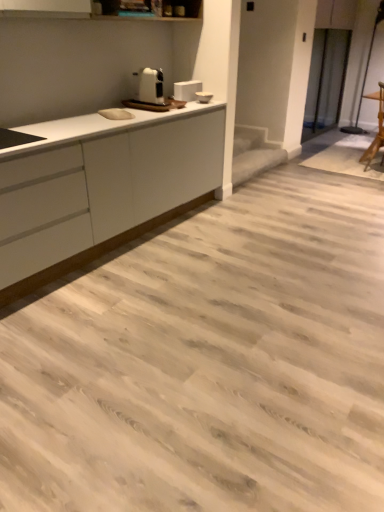
What do you see at coordinates (187, 90) in the screenshot?
I see `white glossy toaster at upper center` at bounding box center [187, 90].

Where is `white plastic toaster at upper center`? The width and height of the screenshot is (384, 512). white plastic toaster at upper center is located at coordinates (150, 86).

What do you see at coordinates (150, 86) in the screenshot?
I see `white plastic toaster at upper center` at bounding box center [150, 86].

Locate an element on the screen. Image resolution: width=384 pixels, height=512 pixels. wooden chair at right is located at coordinates (377, 132).

Image resolution: width=384 pixels, height=512 pixels. I want to click on white glossy toaster at upper center, so click(187, 90).

From the image's perspective, which is above, white plastic toaster at upper center or wooden chair at right?

wooden chair at right.

Does white plastic toaster at upper center contain wooden chair at right?

That's incorrect, wooden chair at right is not inside white plastic toaster at upper center.

Is white plastic toaster at upper center facing away from wooden chair at right?

No, wooden chair at right is not at the back of white plastic toaster at upper center.

How different are the orientations of white plastic toaster at upper center and wooden chair at right in degrees?

white plastic toaster at upper center and wooden chair at right are facing 77.8 degrees away from each other.

Is white matte countertop at left a part of white plastic toaster at upper center?

No, white matte countertop at left is not a part of white plastic toaster at upper center.

Does white plastic toaster at upper center turn towards white matte countertop at left?

No, white plastic toaster at upper center is not turned towards white matte countertop at left.

From a real-world perspective, is white plastic toaster at upper center above or below white matte countertop at left?

white plastic toaster at upper center is above white matte countertop at left.

The height and width of the screenshot is (512, 384). I want to click on home appliance that is above the white matte countertop at left (from the image's perspective), so click(x=150, y=86).

Is white matte countertop at left beside white glossy toaster at upper center?

No, white matte countertop at left is not with white glossy toaster at upper center.

Is white matte countertop at left inside the boundaries of white glossy toaster at upper center, or outside?

white matte countertop at left is outside white glossy toaster at upper center.

Is white matte countertop at left shorter than white glossy toaster at upper center?

Incorrect, the height of white matte countertop at left does not fall short of that of white glossy toaster at upper center.

From the image's perspective, which one is positioned higher, white matte countertop at left or white glossy toaster at upper center?

From the image's view, white glossy toaster at upper center is above.

Is point (140, 75) closer to viewer compared to point (178, 96)?

Yes, it is in front of point (178, 96).

Who is shorter, white plastic toaster at upper center or white glossy toaster at upper center?

With less height is white glossy toaster at upper center.

From a real-world perspective, is white plastic toaster at upper center above or below white glossy toaster at upper center?

Clearly, from a real-world perspective, white plastic toaster at upper center is above white glossy toaster at upper center.

Does point (373, 141) lie in front of point (179, 84)?

No, (373, 141) is behind (179, 84).

Looking at this image, between wooden chair at right and white glossy toaster at upper center, which one is positioned in front?

Positioned in front is white glossy toaster at upper center.

Is white glossy toaster at upper center at the back of wooden chair at right?

wooden chair at right does not have its back to white glossy toaster at upper center.

What's the angular difference between wooden chair at right and white glossy toaster at upper center's facing directions?

77.8 degrees.

From the image's perspective, which one is positioned lower, white matte countertop at left or wooden chair at right?

white matte countertop at left is shown below in the image.

Is point (91, 175) farther from viewer compared to point (382, 82)?

No, (91, 175) is closer to viewer.

What's the angular difference between white matte countertop at left and wooden chair at right's facing directions?

77.8 degrees.

At what (x,y) coordinates should I click in order to perform the action: click on chair on the right of white matte countertop at left. Please return your answer as a coordinate pair (x, y). Looking at the image, I should click on (377, 132).

Is white glossy toaster at upper center located outside wooden chair at right?

Absolutely, white glossy toaster at upper center is external to wooden chair at right.

Is white glossy toaster at upper center facing away from wooden chair at right?

No.

Considering the relative sizes of white glossy toaster at upper center and wooden chair at right in the image provided, is white glossy toaster at upper center bigger than wooden chair at right?

No.

Find the location of a particular element. The image size is (384, 512). chair that appears above the white plastic toaster at upper center (from the image's perspective) is located at coordinates (377, 132).

Image resolution: width=384 pixels, height=512 pixels. In order to click on home appliance behind the white matte countertop at left in this screenshot , I will do `click(150, 86)`.

Which object lies nearer to the anchor point wooden chair at right, white plastic toaster at upper center or white glossy toaster at upper center?

white glossy toaster at upper center.

Estimate the real-world distances between objects in this image. Which object is closer to white plastic toaster at upper center, white glossy toaster at upper center or white matte countertop at left?

Among the two, white glossy toaster at upper center is located nearer to white plastic toaster at upper center.

When comparing their distances from white matte countertop at left, does white glossy toaster at upper center or white plastic toaster at upper center seem further?

Among the two, white glossy toaster at upper center is located further to white matte countertop at left.

When comparing their distances from white plastic toaster at upper center, does wooden chair at right or white matte countertop at left seem closer?

The object closer to white plastic toaster at upper center is white matte countertop at left.

Looking at the image, which one is located further to white glossy toaster at upper center, wooden chair at right or white matte countertop at left?

wooden chair at right.

Considering their positions, is white glossy toaster at upper center positioned further to white matte countertop at left than wooden chair at right?

Among the two, wooden chair at right is located further to white matte countertop at left.

Looking at the image, which one is located further to white glossy toaster at upper center, white matte countertop at left or white plastic toaster at upper center?

white matte countertop at left is further to white glossy toaster at upper center.

Consider the image. Estimate the real-world distances between objects in this image. Which object is closer to white glossy toaster at upper center, white plastic toaster at upper center or wooden chair at right?

Based on the image, white plastic toaster at upper center appears to be nearer to white glossy toaster at upper center.

Find the location of a particular element. Image resolution: width=384 pixels, height=512 pixels. appliance between white plastic toaster at upper center and wooden chair at right is located at coordinates (187, 90).

This screenshot has width=384, height=512. In order to click on home appliance between white matte countertop at left and white glossy toaster at upper center in the front-back direction in this screenshot , I will do `click(150, 86)`.

I want to click on appliance between white matte countertop at left and wooden chair at right in the horizontal direction, so click(x=187, y=90).

Locate an element on the screen. Image resolution: width=384 pixels, height=512 pixels. home appliance between white matte countertop at left and wooden chair at right from left to right is located at coordinates pos(150,86).